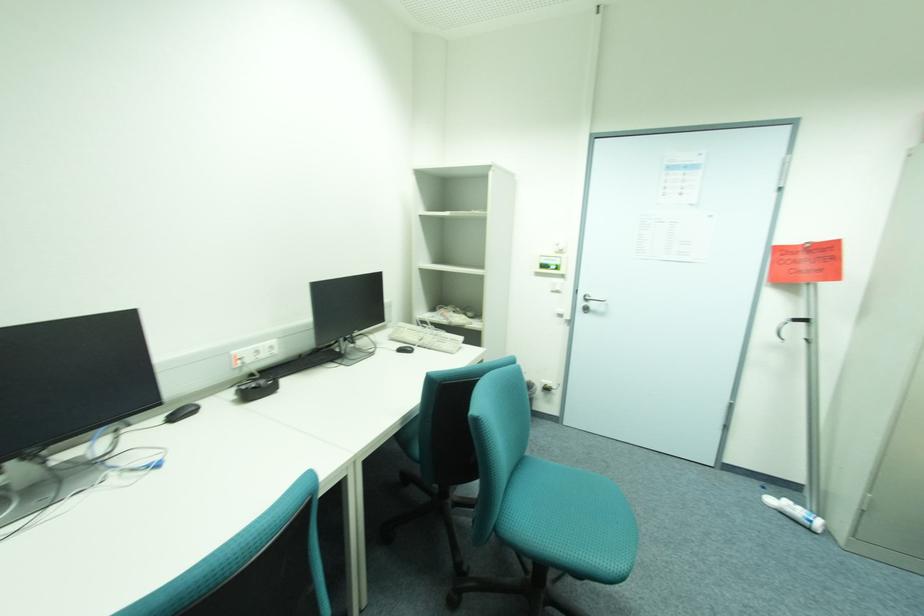
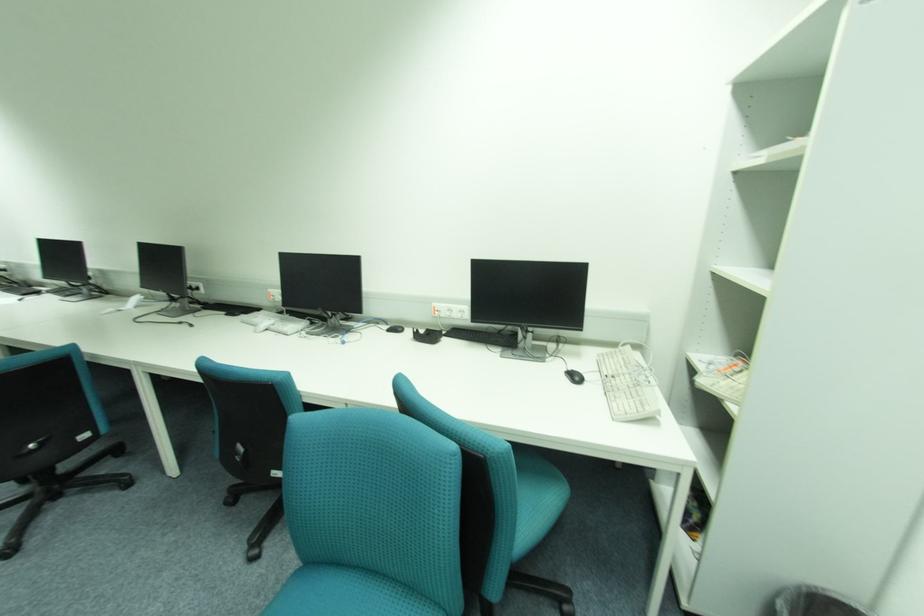
Locate, in the second image, the point that corresponds to (445,342) in the first image.

(631, 392)